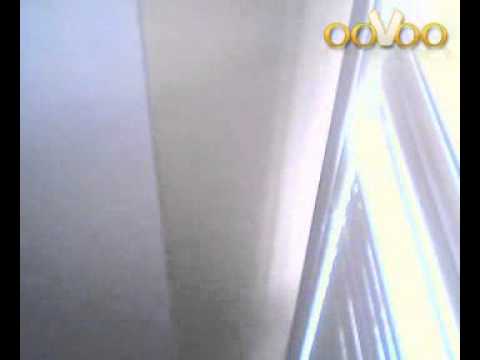
The image size is (480, 360). I want to click on curtain, so coord(349,306).